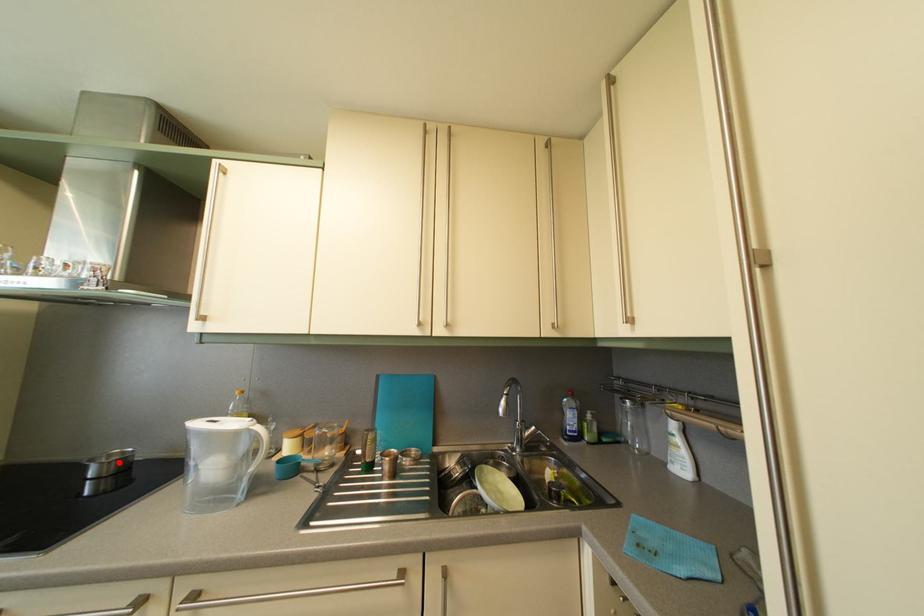
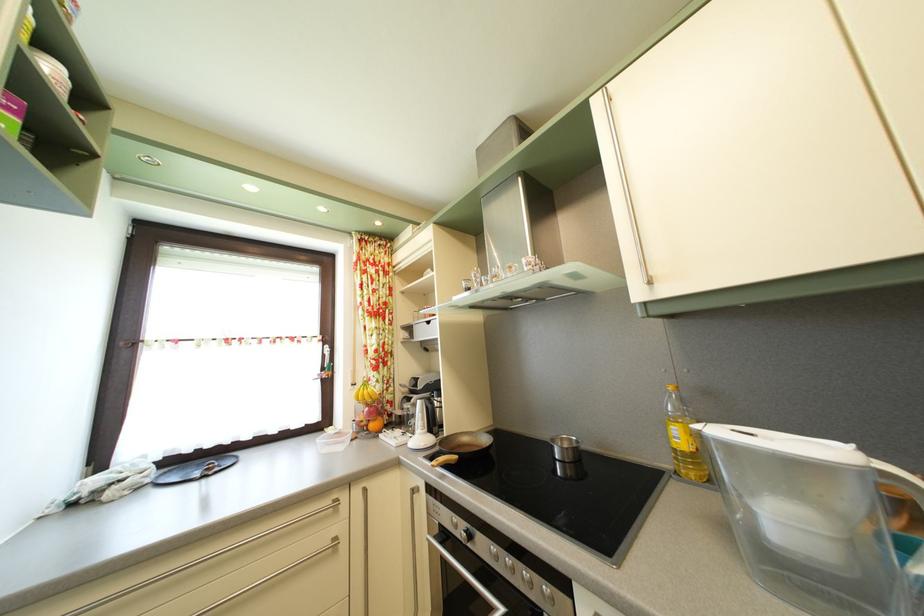
Where in the second image is the point corresponding to the highlighted location from the first image?

(569, 448)